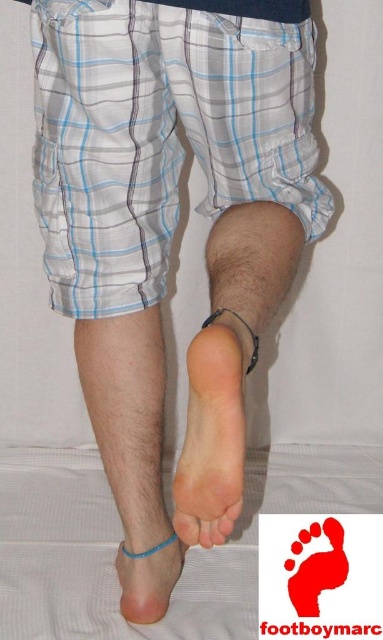
You are a fashion designer analyzing a model wearing light plaid shorts and a dark top. The model is in a pose where one foot is extended upwards, showing the sole. You need to compare the size of the pink smooth foot at center and the transparent blue toe at lower center. Which object is larger?

The pink smooth foot at center is bigger than the transparent blue toe at lower center according to the description.

You are a photographer setting up a shoot in this scene. You want to ensure the transparent blue toe at lower center is visible in the final image. Given that the white plaid shorts at lower left are blocking part of it, what adjustment could you make to the camera angle or subject position?

Since the transparent blue toe at lower center is behind the white plaid shorts at lower left, you could move the camera angle slightly to the side or have the subject shift their position so that the toe moves forward relative to the shorts, making it visible without obstruction.